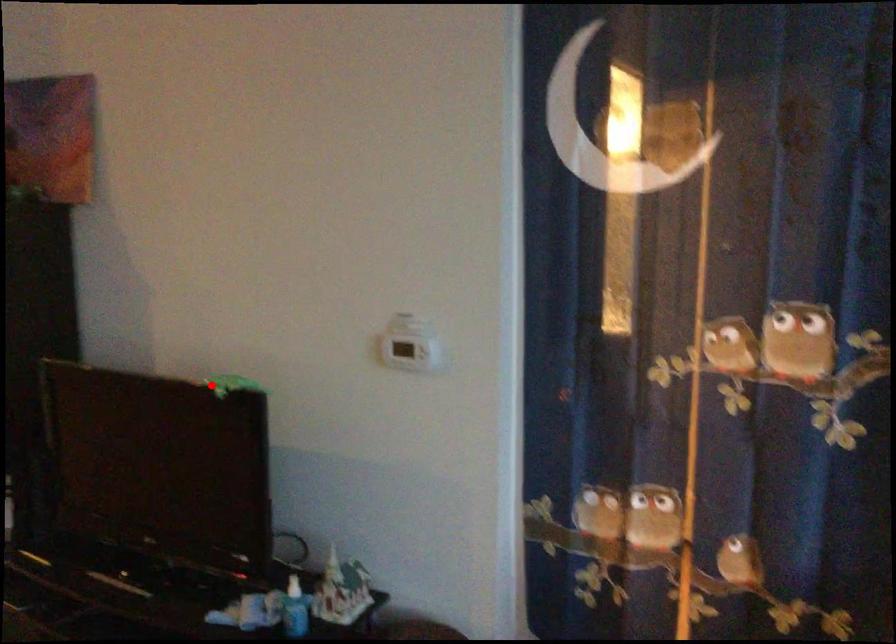
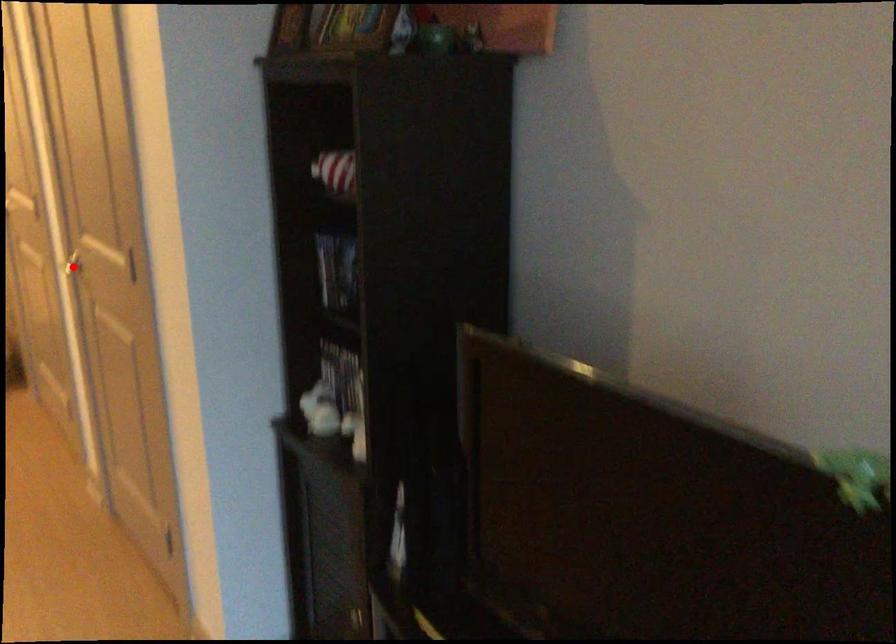
I am providing you with two images of the same scene from different viewpoints. A red point is marked on the first image and another point is marked on the second image. Does the point marked in image1 correspond to the same location as the one in image2?

No